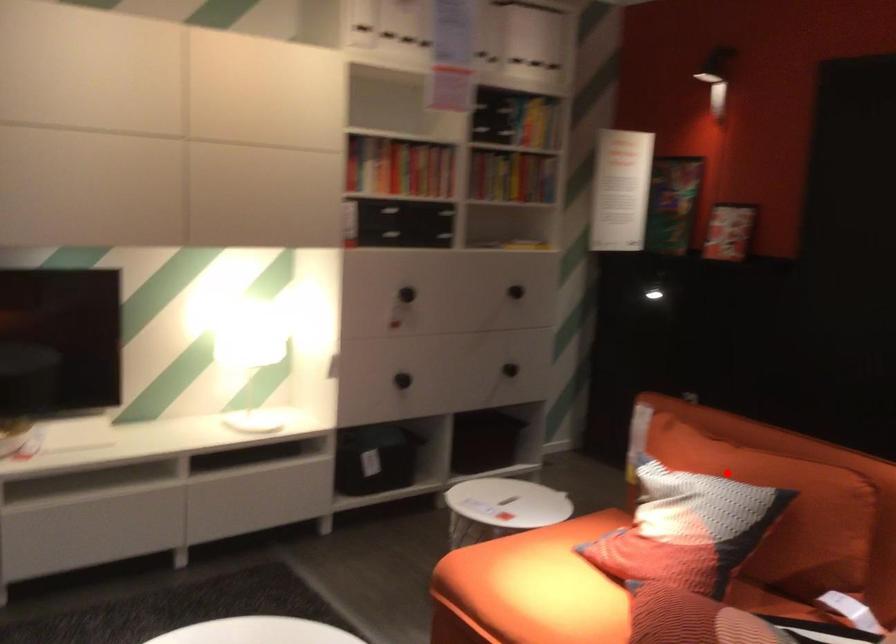
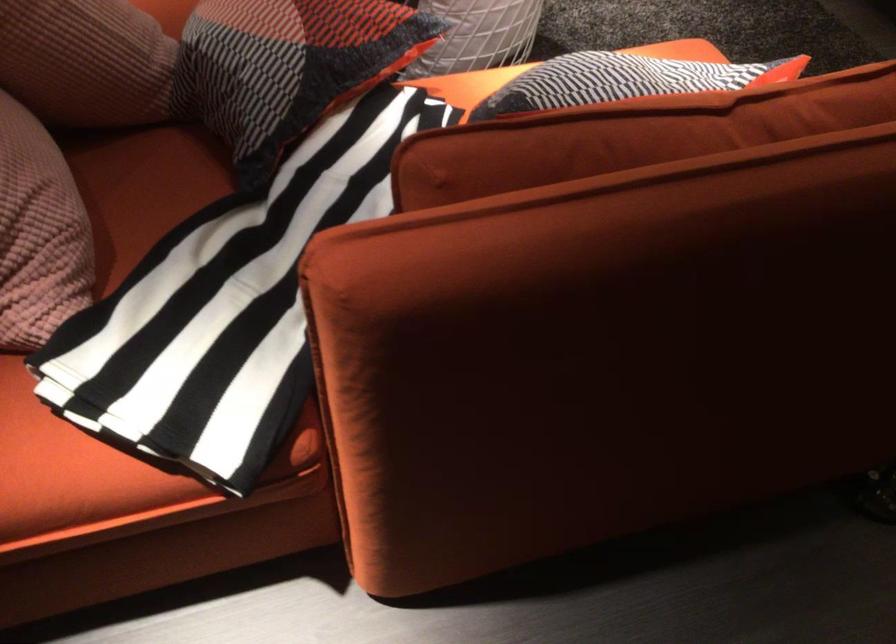
Question: A red point is marked in image1. In image2, is the corresponding 3D point closer to the camera or farther? Reply with the corresponding letter.

Choices:
 (A) The corresponding 3D point is closer.
 (B) The corresponding 3D point is farther.

Answer: (A)